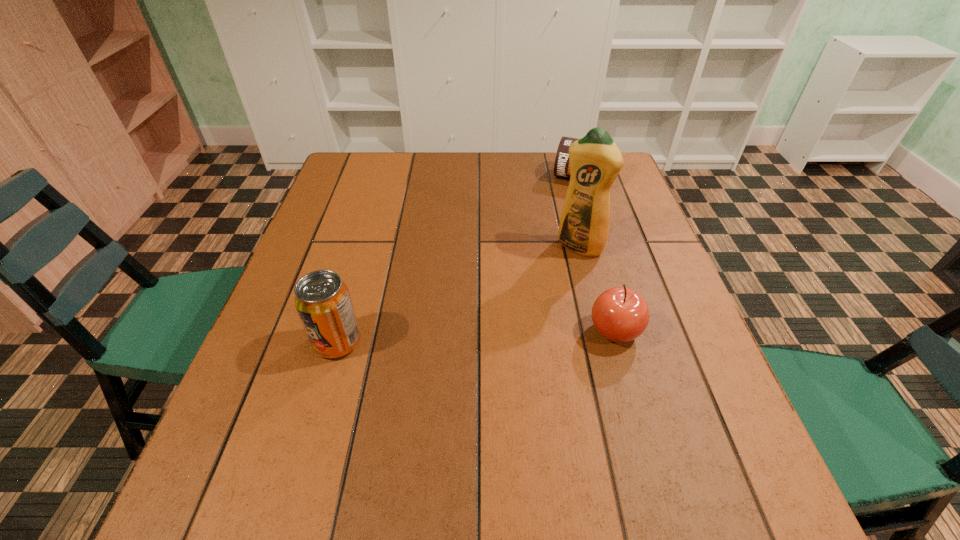
This screenshot has width=960, height=540. Identify the location of vacant space on the desktop that is between the second tallest object and the apple and is positioned on the front label of the farthest object. (518, 335).

You are a GUI agent. You are given a task and a screenshot of the screen. Output one action in this format:
    pyautogui.click(x=<x>, y=<y>)
    Task: Click on the vacant space on the desktop that is between the soda can and the apple and is positioned on the label of the third nearest object
    This screenshot has height=540, width=960.
    Given the screenshot: What is the action you would take?
    pyautogui.click(x=516, y=335)